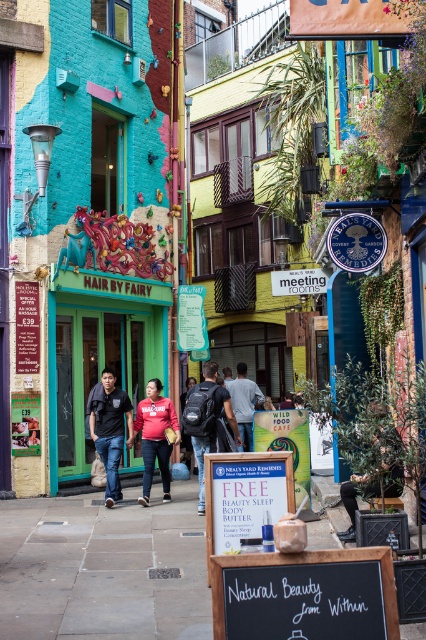
Question: Considering the real-world distances, which object is farthest from the smooth stone pavement at center?

Choices:
 (A) matte black backpack at center
 (B) matte gray backpack at center

Answer: (B)

Question: Which is nearer to the red cotton hoodie at center?

Choices:
 (A) black chalkboard at center
 (B) matte black backpack at center
 (C) matte gray backpack at center
 (D) green matte door at center

Answer: (B)

Question: Based on their relative distances, which object is farther from the red cotton hoodie at center?

Choices:
 (A) black chalkboard at center
 (B) leather jacket at lower right
 (C) matte black backpack at center

Answer: (A)

Question: Can you confirm if dark blue jeans at center is positioned to the right of matte gray backpack at center?

Choices:
 (A) no
 (B) yes

Answer: (A)

Question: Does black chalkboard at center have a larger size compared to matte gray backpack at center?

Choices:
 (A) no
 (B) yes

Answer: (B)

Question: From the image, what is the correct spatial relationship of green matte door at center in relation to matte black backpack at center?

Choices:
 (A) left
 (B) right

Answer: (A)